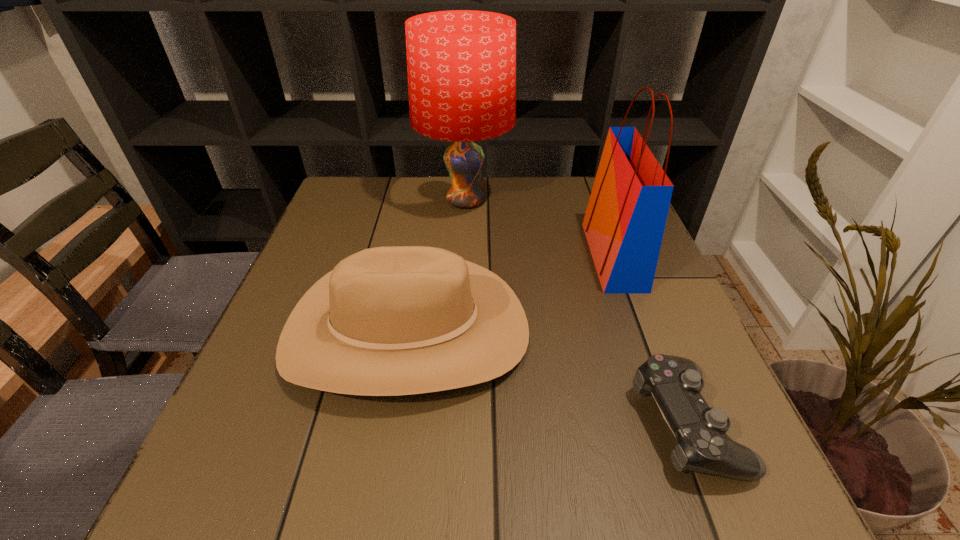
What are the coordinates of `vacant space at the far left corner of the desktop` in the screenshot? It's located at (349, 212).

The width and height of the screenshot is (960, 540). In order to click on vacant region at the far right corner of the desktop in this screenshot , I will do `click(587, 205)`.

The height and width of the screenshot is (540, 960). Identify the location of free space between the lampshade and the shopping bag. 540,228.

You are a GUI agent. You are given a task and a screenshot of the screen. Output one action in this format:
    pyautogui.click(x=<x>, y=<y>)
    Task: Click on the free point between the lampshade and the shopping bag
    Image resolution: width=960 pixels, height=540 pixels.
    Given the screenshot: What is the action you would take?
    pyautogui.click(x=540, y=228)

Identify the location of vacant space that's between the third tallest object and the shortest object. This screenshot has width=960, height=540. (546, 377).

At what (x,y) coordinates should I click in order to perform the action: click on free space between the shortest object and the shopping bag. Please return your answer as a coordinate pair (x, y). This screenshot has height=540, width=960. Looking at the image, I should click on [650, 340].

Find the location of a particular element. This screenshot has height=540, width=960. free space between the lampshade and the control is located at coordinates (576, 312).

Locate an element on the screen. empty space that is in between the control and the third tallest object is located at coordinates (546, 377).

Where is `the third closest object to the cowboy hat`? The width and height of the screenshot is (960, 540). the third closest object to the cowboy hat is located at coordinates (624, 223).

Find the location of `object that ranks as the second closest to the shortest object`. object that ranks as the second closest to the shortest object is located at coordinates (624, 223).